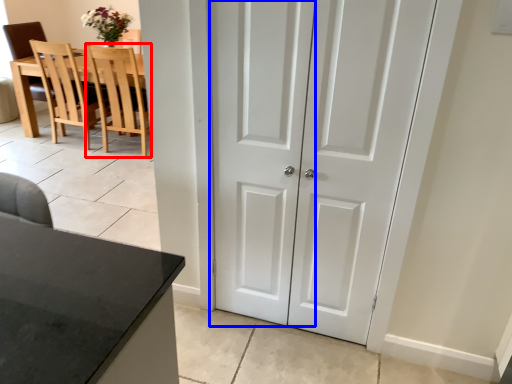
Question: Which object appears farthest to the camera in this image, chair (highlighted by a red box) or screen door (highlighted by a blue box)?

Choices:
 (A) chair
 (B) screen door

Answer: (A)